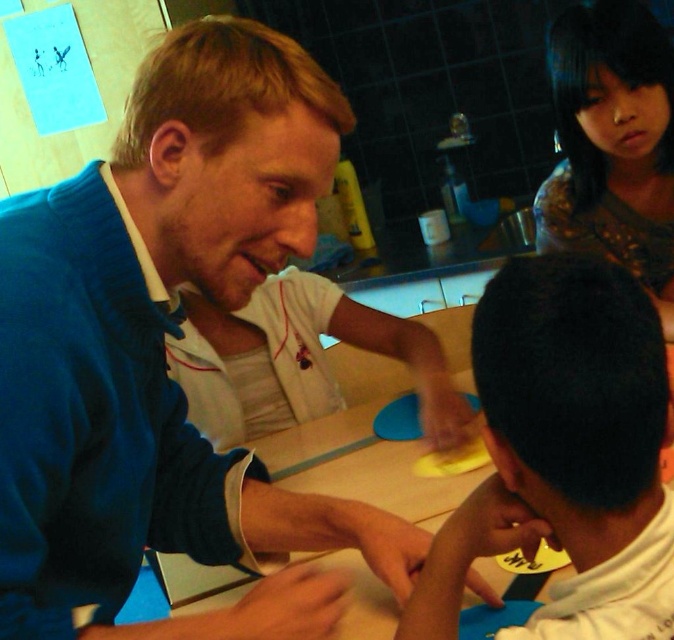
You are organizing a classroom and need to place a large poster on the wall. The poster requires a hook that can support heavy items. Which object between the blue fleece jacket at upper left and the wooden table at center would you consider to determine the best location for the hook?

The wooden table at center is larger than the blue fleece jacket at upper left, so the hook should be placed near the wooden table at center as it likely has more space and stability for the heavy poster.

You are a person who needs to place a 50 cm long object between the matte brown hair at upper right and the wooden table at center. Is there enough space?

The distance between the matte brown hair at upper right and the wooden table at center is 63.56 centimeters. Since the object is 50 cm long, there is enough space to place it between them.

You are standing in the room and want to locate the blue fleece jacket at upper left. According to the coordinates provided, where should you look to find it?

The blue fleece jacket at upper left is located at coordinates point (162, 352).